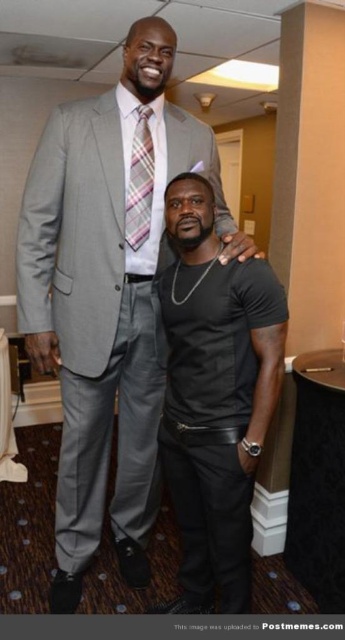
Where is `black matte t-shirt at center`? This screenshot has width=345, height=640. black matte t-shirt at center is located at coordinates (214, 396).

Is black matte t-shirt at center smaller than plaid fabric tie at upper center?

No, black matte t-shirt at center is not smaller than plaid fabric tie at upper center.

Describe the element at coordinates (214, 396) in the screenshot. This screenshot has height=640, width=345. I see `black matte t-shirt at center` at that location.

This screenshot has width=345, height=640. Identify the location of black matte t-shirt at center. (214, 396).

In order to click on matte gray suit at center in this screenshot , I will do `click(106, 298)`.

Where is `matte gray suit at center`? matte gray suit at center is located at coordinates (106, 298).

What do you see at coordinates (106, 298) in the screenshot? I see `matte gray suit at center` at bounding box center [106, 298].

Is matte gray suit at center below black matte t-shirt at center?

No.

Measure the distance between matte gray suit at center and camera.

They are 1.53 meters apart.

This screenshot has height=640, width=345. What are the coordinates of `matte gray suit at center` in the screenshot? It's located at (106, 298).